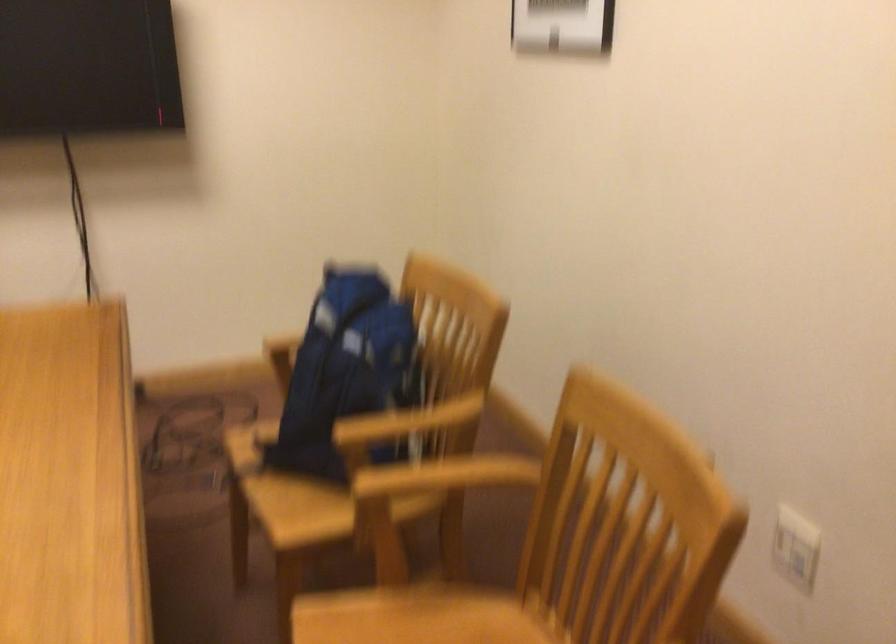
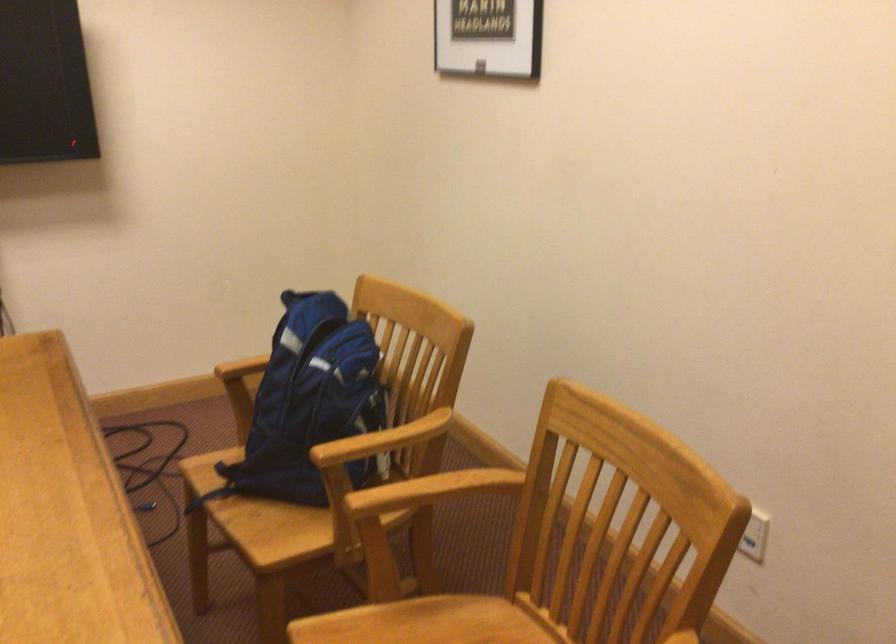
Where in the second image is the point corresponding to point 449,477 from the first image?

(436, 488)